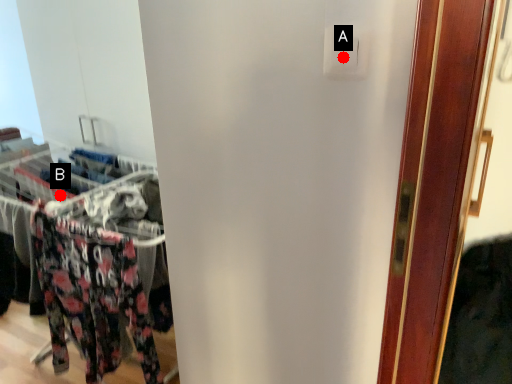
Question: Two points are circled on the image, labeled by A and B beside each circle. Which point is farther from the camera taking this photo?

Choices:
 (A) A is further
 (B) B is further

Answer: (B)